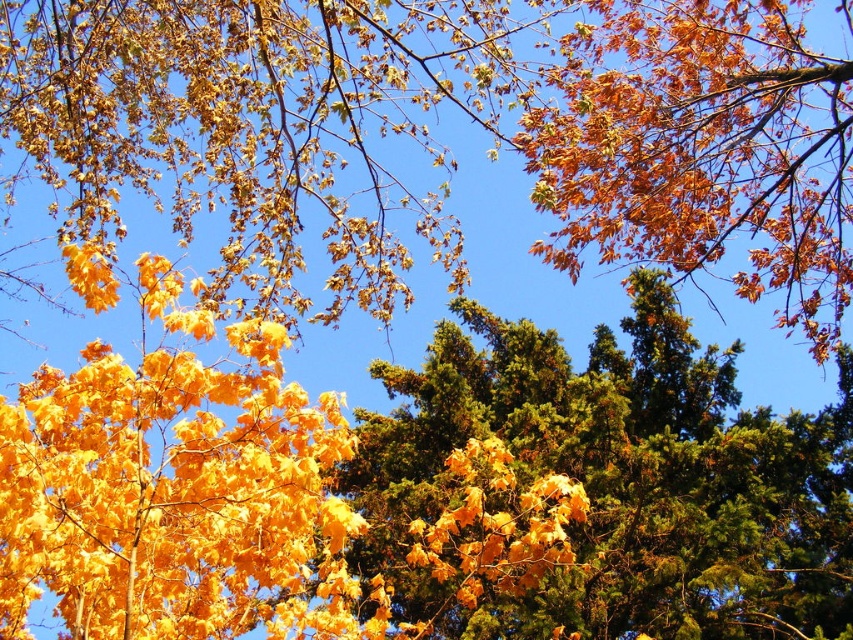
Does point (474, 387) come farther from viewer compared to point (305, 545)?

That is True.

Can you confirm if green textured pine tree at center is smaller than shiny golden leaves at left?

Actually, green textured pine tree at center might be larger than shiny golden leaves at left.

Who is more forward, (676,390) or (33,394)?

Positioned in front is point (33,394).

Locate an element on the screen. The height and width of the screenshot is (640, 853). green textured pine tree at center is located at coordinates (x=601, y=486).